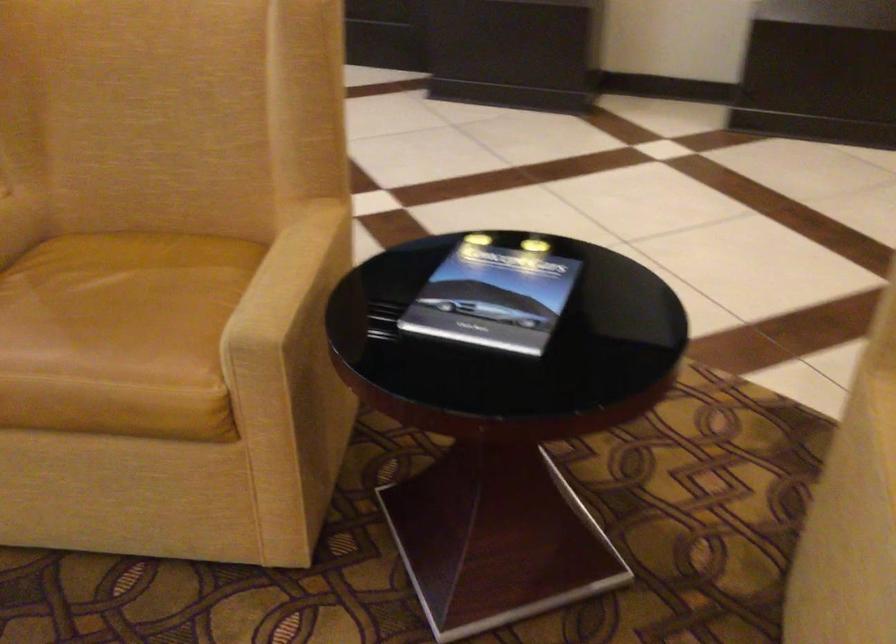
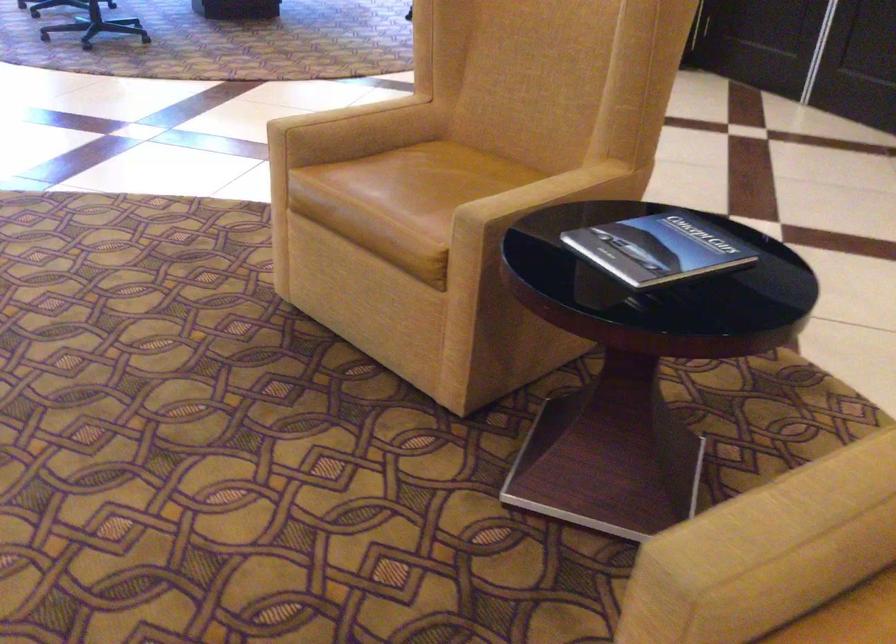
Where in the second image is the point corresponding to point 106,286 from the first image?

(440, 174)